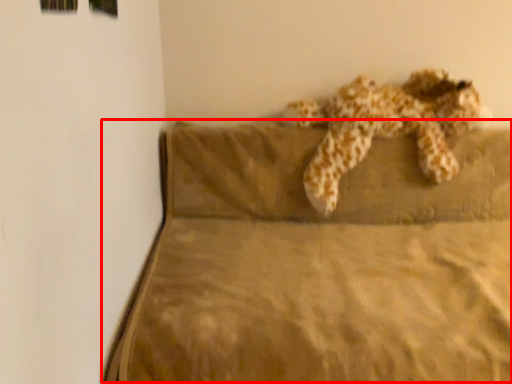
Question: Where is mattress (annotated by the red box) located in relation to animal in the image?

Choices:
 (A) left
 (B) right

Answer: (A)